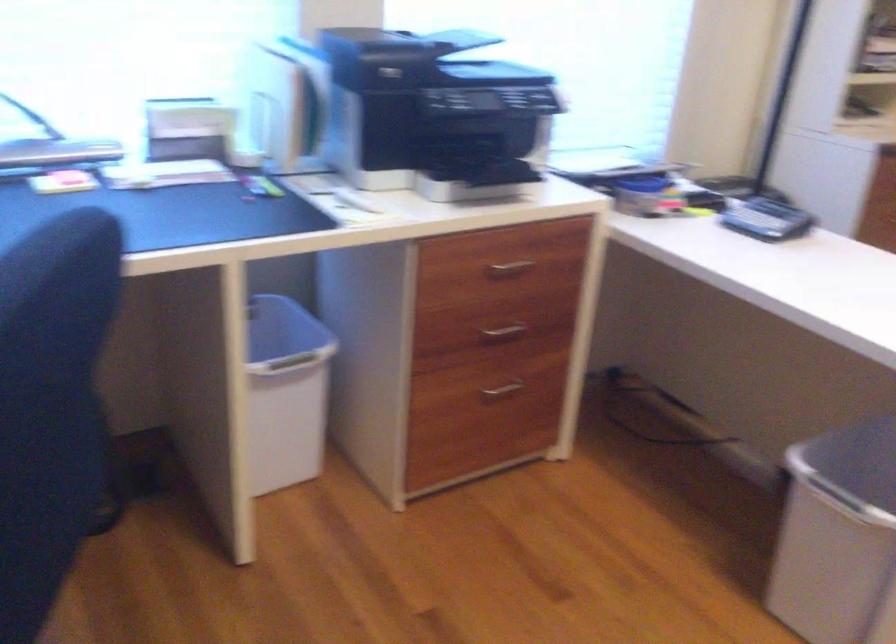
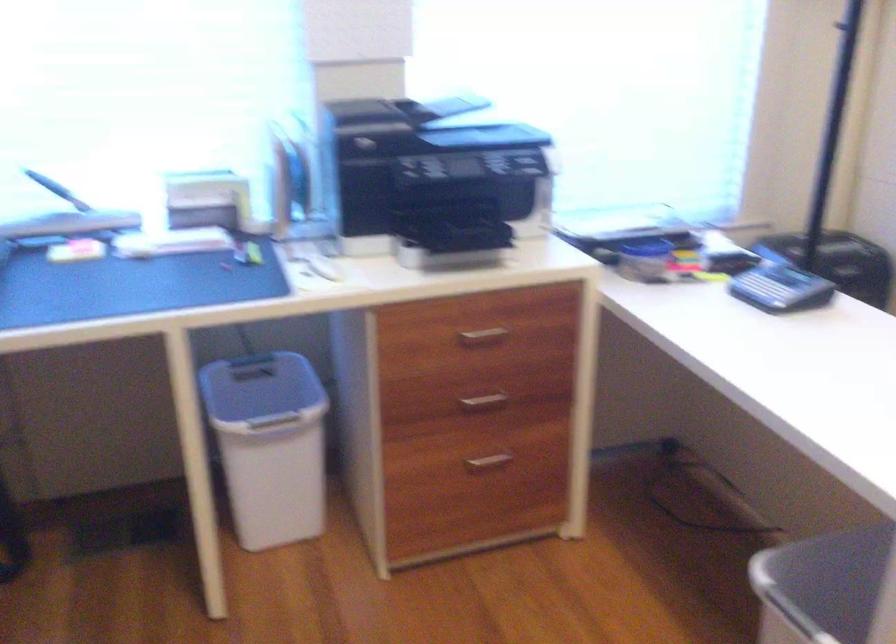
Locate, in the second image, the point that corresponds to (x=497, y=390) in the first image.

(487, 462)